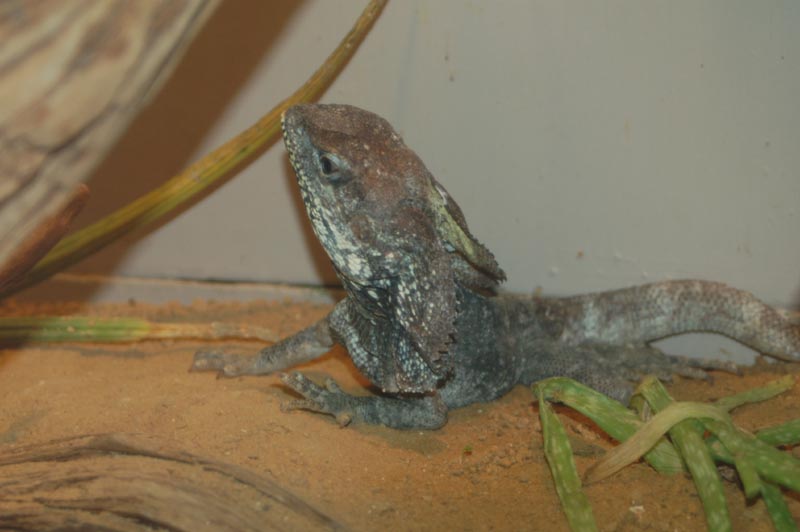
The height and width of the screenshot is (532, 800). What are the coordinates of `wall` in the screenshot? It's located at tap(672, 189).